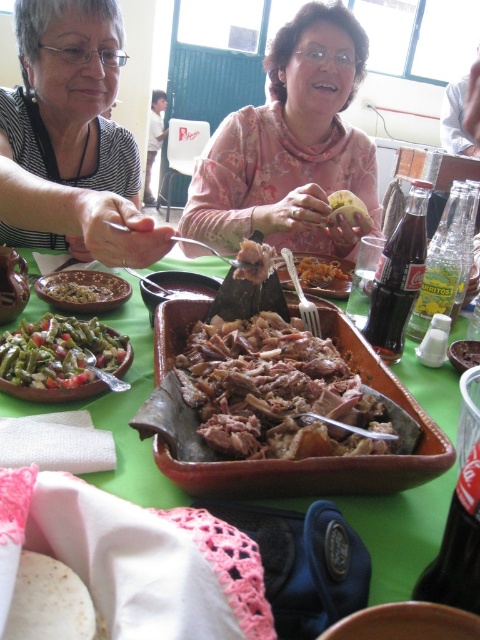
Looking at this image, you are a guest at the table and want to reach for the white creamy sauce at center. Which direction should you move your hand relative to the green fabric table at center?

The white creamy sauce at center is to the left of the green fabric table at center, so you should move your hand to the left side of the green fabric table at center to reach it.

You are a guest at the table and want to serve yourself some green matte beans at center and brown matte bowl at center. Which container holds more of its respective food?

The green matte beans at center is bigger than the brown matte bowl at center, so it can hold more food.